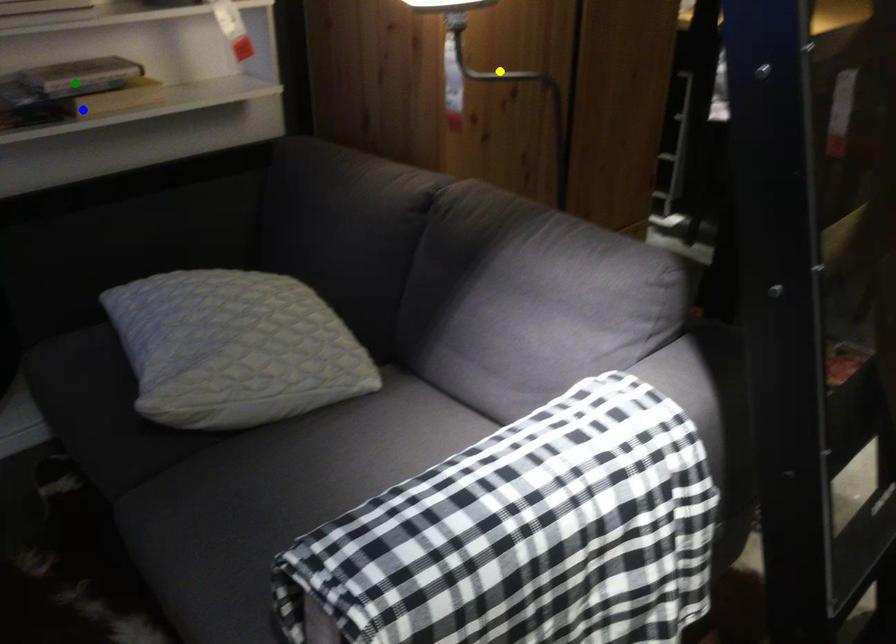
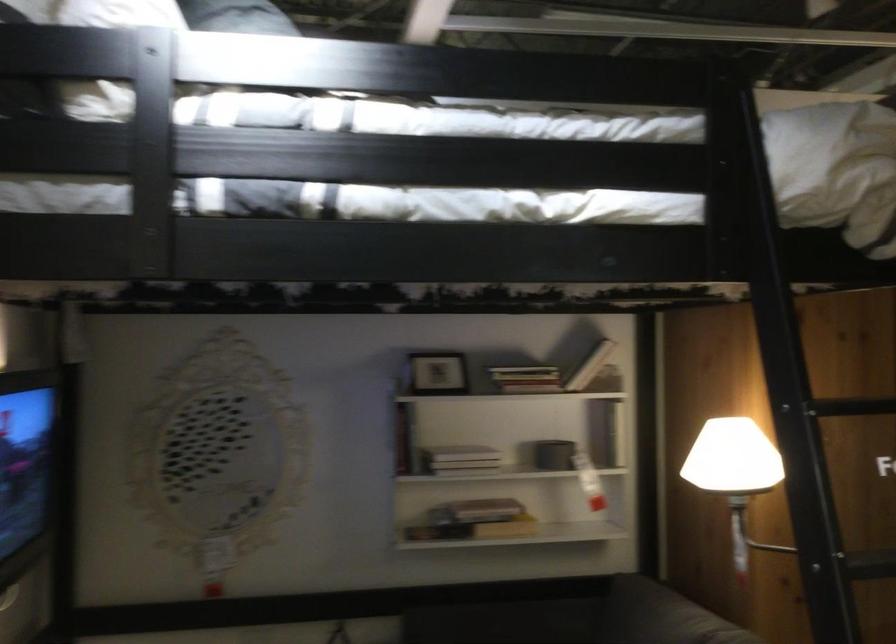
I am providing you with two images of the same scene from different viewpoints. Three points are marked in image1. Which point corresponds to a part or object that is occluded in image2?In image1, three points are marked. Which of them correspond to a part or object that is occluded in image2?Among the three points shown in image1, which one corresponds to a part or object that is no longer visible due to occlusion in image2?

yellow point